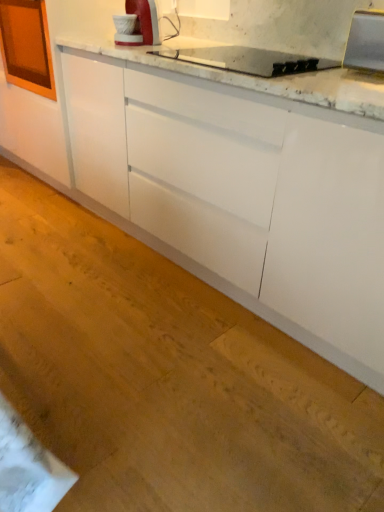
Describe the element at coordinates (366, 41) in the screenshot. I see `metallic gray stove at upper right` at that location.

Locate an element on the screen. This screenshot has width=384, height=512. metallic gray stove at upper right is located at coordinates (366, 41).

Locate an element on the screen. Image resolution: width=384 pixels, height=512 pixels. metallic gray stove at upper right is located at coordinates (366, 41).